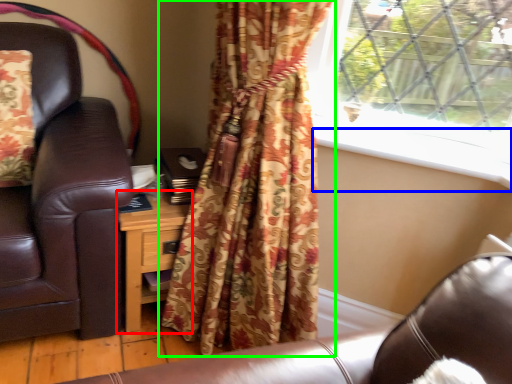
Question: Considering the real-world distances, which object is farthest from nightstand (highlighted by a red box)? window sill (highlighted by a blue box) or curtain (highlighted by a green box)?

Choices:
 (A) window sill
 (B) curtain

Answer: (A)